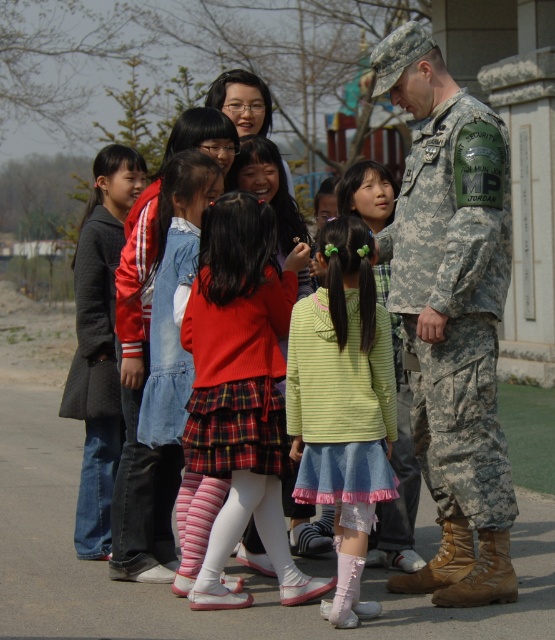
Who is lower down, camouflage uniform at right or dark gray wool coat at left?

dark gray wool coat at left is below.

Find the location of a particular element. Image resolution: width=555 pixels, height=640 pixels. camouflage uniform at right is located at coordinates click(x=452, y=314).

Identify the location of camouflage uniform at right. The height and width of the screenshot is (640, 555). [452, 314].

The width and height of the screenshot is (555, 640). I want to click on camouflage uniform at right, so click(452, 314).

Is point (418, 93) less distant than point (334, 493)?

No, it is not.

Is point (475, 362) positioned behind point (290, 324)?

Yes, point (475, 362) is behind point (290, 324).

Is point (508, 522) farther from viewer compared to point (360, 240)?

Yes, it is behind point (360, 240).

The width and height of the screenshot is (555, 640). I want to click on camouflage uniform at right, so click(x=452, y=314).

Who is lower down, light green denim skirt at center or dark gray wool coat at left?

light green denim skirt at center is below.

Does light green denim skirt at center appear over dark gray wool coat at left?

Incorrect, light green denim skirt at center is not positioned above dark gray wool coat at left.

Who is more distant from viewer, [305,444] or [98,205]?

The point [98,205] is behind.

You are a GUI agent. You are given a task and a screenshot of the screen. Output one action in this format:
    pyautogui.click(x=<x>, y=<y>)
    Task: Click on the light green denim skirt at center
    This screenshot has width=555, height=640.
    Given the screenshot: What is the action you would take?
    pyautogui.click(x=342, y=403)